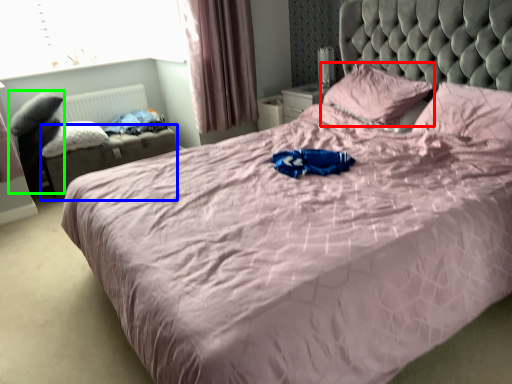
Question: Which is nearer to the pillow (highlighted by a red box)? footrest (highlighted by a blue box) or swivel chair (highlighted by a green box).

Choices:
 (A) footrest
 (B) swivel chair

Answer: (A)